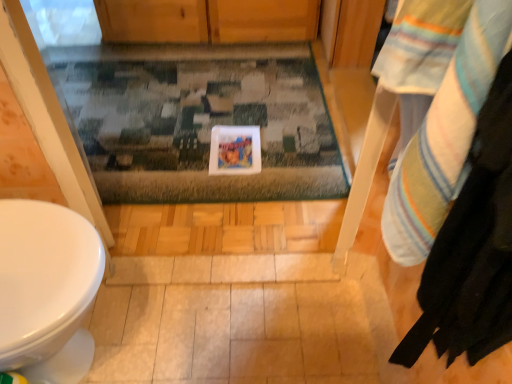
Identify the location of vacant region under multicolored textured rug at center (from a real-world perspective). The image size is (512, 384). (173, 102).